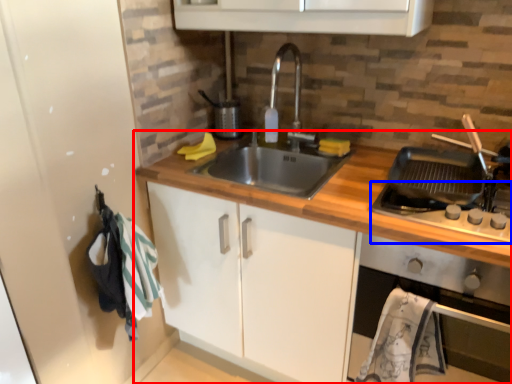
Question: Among these objects, which one is nearest to the camera, countertop (highlighted by a red box) or gas stove (highlighted by a blue box)?

Choices:
 (A) countertop
 (B) gas stove

Answer: (A)